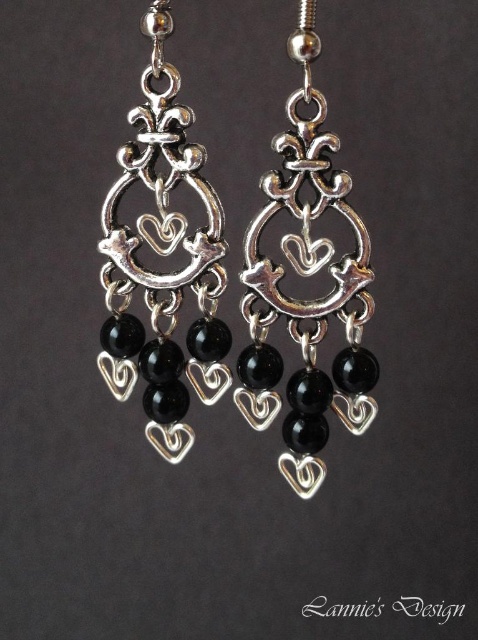
You are a photographer holding a camera and want to capture a closeup of the point at coordinates point (302,122). The camera is currently 1.16 meters away from the point. Can you get a clear closeup shot without moving the camera?

The point at coordinates point (302,122) is 1.16 meters away from the camera. Since the camera is already positioned at that distance, you can capture a clear closeup shot without needing to move it closer.